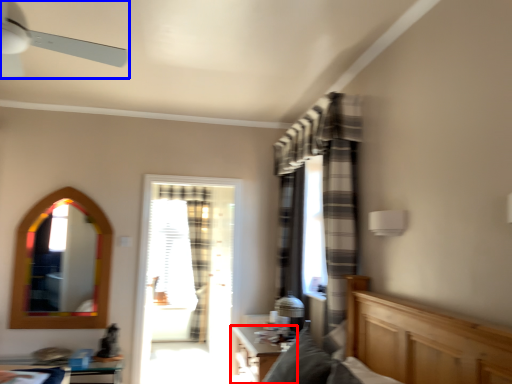
Question: Among these objects, which one is farthest to the camera, table (highlighted by a red box) or ceiling fan (highlighted by a blue box)?

Choices:
 (A) table
 (B) ceiling fan

Answer: (A)